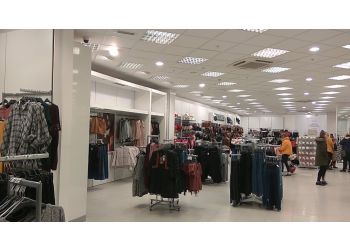
I want to click on clothing racks, so click(x=169, y=172), click(x=246, y=175), click(x=213, y=157).